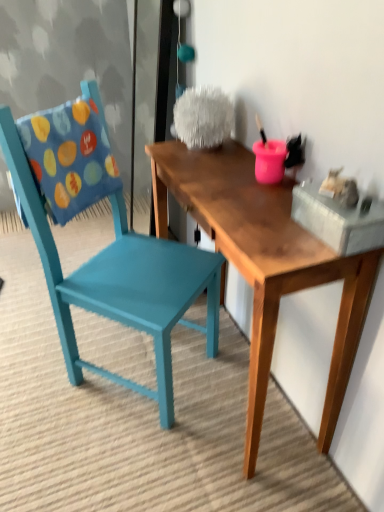
Locate an element on the screen. This screenshot has width=384, height=512. vacant area that lies between wooden table at center and teal painted wood chair at left is located at coordinates (178, 438).